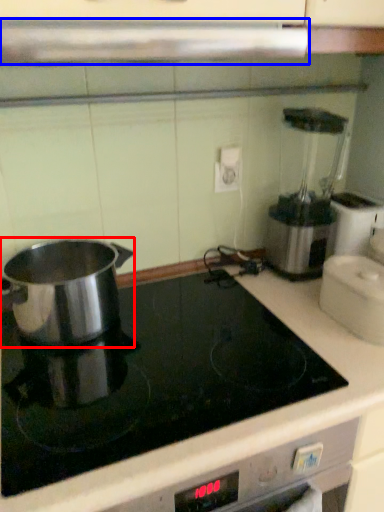
Question: Which object is further to the camera taking this photo, kitchen appliance (highlighted by a red box) or exhaust hood (highlighted by a blue box)?

Choices:
 (A) kitchen appliance
 (B) exhaust hood

Answer: (A)